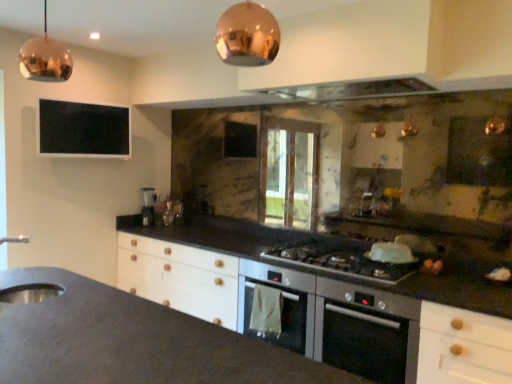
Question: From the image's perspective, is metallic glass at upper center below copper reflective pendant light at upper center, which appears as the second light fixture when viewed from the left?

Choices:
 (A) no
 (B) yes

Answer: (A)

Question: Are metallic glass at upper center and copper reflective pendant light at upper center, which is the 2th light fixture in back-to-front order, beside each other?

Choices:
 (A) no
 (B) yes

Answer: (A)

Question: Is metallic glass at upper center not close to copper reflective pendant light at upper center, which is the 1th light fixture from right to left?

Choices:
 (A) no
 (B) yes

Answer: (B)

Question: Is metallic glass at upper center aimed at copper reflective pendant light at upper center, which is the 1th light fixture from right to left?

Choices:
 (A) yes
 (B) no

Answer: (B)

Question: Does metallic glass at upper center have a larger size compared to copper reflective pendant light at upper center, which appears as the second light fixture when viewed from the left?

Choices:
 (A) yes
 (B) no

Answer: (A)

Question: Is copper reflective pendant light at upper center, which appears as the second light fixture when viewed from the left, taller or shorter than stainless steel oven at center?

Choices:
 (A) tall
 (B) short

Answer: (B)

Question: In the image, is copper reflective pendant light at upper center, the 1th light fixture positioned from the front, positioned in front of or behind stainless steel oven at center?

Choices:
 (A) front
 (B) behind

Answer: (A)

Question: In terms of size, does copper reflective pendant light at upper center, which appears as the second light fixture when viewed from the left, appear bigger or smaller than stainless steel oven at center?

Choices:
 (A) big
 (B) small

Answer: (B)

Question: In terms of width, does copper reflective pendant light at upper center, the 1th light fixture positioned from the front, look wider or thinner when compared to stainless steel oven at center?

Choices:
 (A) thin
 (B) wide

Answer: (A)

Question: In terms of width, does metallic glass at upper center look wider or thinner when compared to satin silver gas stove at center?

Choices:
 (A) thin
 (B) wide

Answer: (A)

Question: From a real-world perspective, relative to satin silver gas stove at center, is metallic glass at upper center vertically above or below?

Choices:
 (A) above
 (B) below

Answer: (A)

Question: From the image's perspective, is metallic glass at upper center located above or below satin silver gas stove at center?

Choices:
 (A) above
 (B) below

Answer: (A)

Question: From their relative heights in the image, would you say metallic glass at upper center is taller or shorter than satin silver gas stove at center?

Choices:
 (A) short
 (B) tall

Answer: (A)

Question: From the image's perspective, is stainless steel sink at lower left located above or below stainless steel oven at center?

Choices:
 (A) above
 (B) below

Answer: (A)

Question: Is point (45, 283) closer or farther from the camera than point (323, 311)?

Choices:
 (A) closer
 (B) farther

Answer: (A)